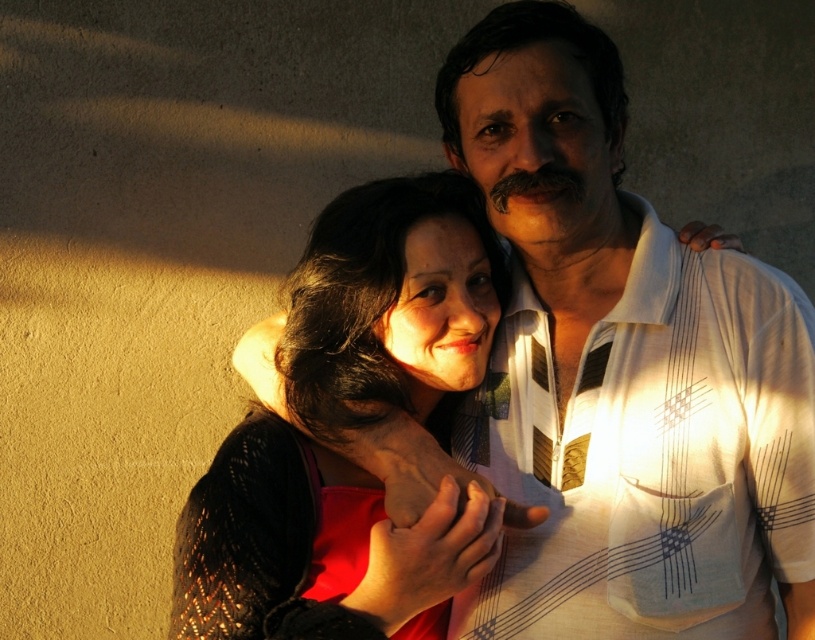
Question: Is white striped shirt at center to the left of matte black sweater at center from the viewer's perspective?

Choices:
 (A) no
 (B) yes

Answer: (A)

Question: Can you confirm if white striped shirt at center is positioned below matte black sweater at center?

Choices:
 (A) no
 (B) yes

Answer: (A)

Question: Among these points, which one is farthest from the camera?

Choices:
 (A) (432, 548)
 (B) (615, 132)

Answer: (B)

Question: Can you confirm if white striped shirt at center is positioned above matte black sweater at center?

Choices:
 (A) no
 (B) yes

Answer: (B)

Question: Among these points, which one is farthest from the camera?

Choices:
 (A) (448, 278)
 (B) (807, 564)

Answer: (A)